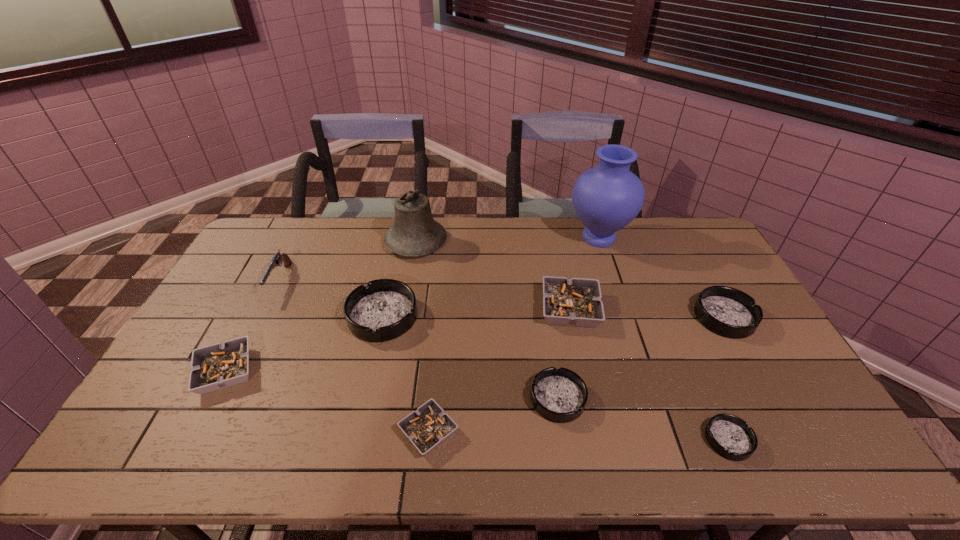
I want to click on vacant area that lies between the second smallest gray ashtray and the rightmost object, so click(x=475, y=344).

At what (x,y) coordinates should I click in order to perform the action: click on empty space that is in between the gun and the farthest gray ashtray. Please return your answer as a coordinate pair (x, y). The image size is (960, 540). Looking at the image, I should click on (425, 295).

Where is `free space between the smallest dark ashtray and the gun`? This screenshot has height=540, width=960. free space between the smallest dark ashtray and the gun is located at coordinates (504, 360).

At what (x,y) coordinates should I click in order to perform the action: click on vacant point located between the eighth shortest object and the second gray ashtray from right to left. Please return your answer as a coordinate pair (x, y). Image resolution: width=960 pixels, height=540 pixels. Looking at the image, I should click on (354, 356).

Locate an element on the screen. The height and width of the screenshot is (540, 960). object that is the second closest to the bell is located at coordinates (278, 258).

Identify the location of object that ranks as the closest to the second dark ashtray from right to left. This screenshot has height=540, width=960. (726, 311).

Locate which ashtray is the fourth closest to the biggest gray ashtray. Please provide its 2D coordinates. Your answer should be formatted as a tuple, i.e. [(x, y)], where the tuple contains the x and y coordinates of a point satisfying the conditions above.

[(427, 427)]

Image resolution: width=960 pixels, height=540 pixels. I want to click on ashtray that stands as the second closest to the leftmost gray ashtray, so click(x=427, y=427).

Point out which dark ashtray is positioned as the third nearest to the vase. Please provide its 2D coordinates. Your answer should be formatted as a tuple, i.e. [(x, y)], where the tuple contains the x and y coordinates of a point satisfying the conditions above.

[(385, 309)]

This screenshot has width=960, height=540. What are the coordinates of `dark ashtray that is the fourth closest to the eighth shortest object` in the screenshot? It's located at (726, 311).